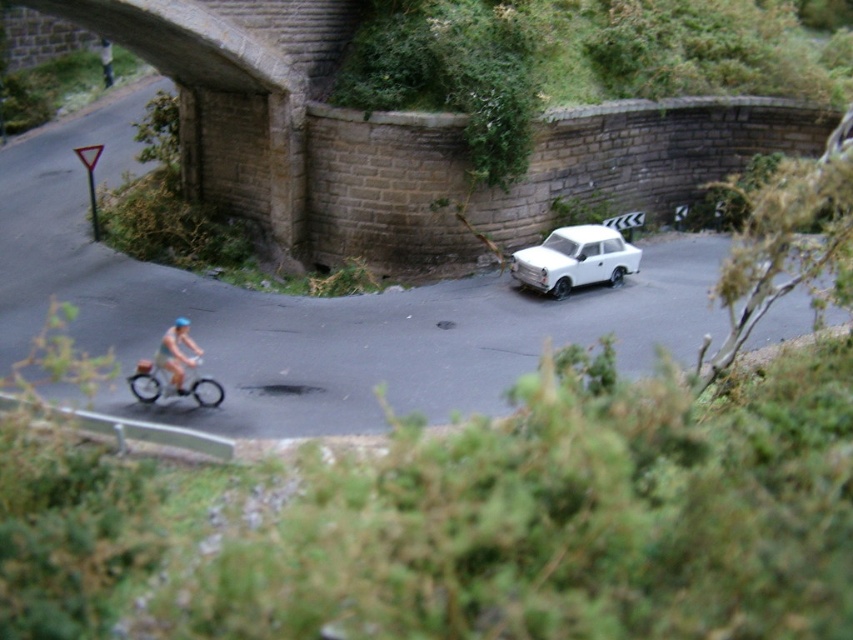
Looking at this image, what object is located at the coordinates point (575,259)?

The white matte car at center is located at point (575,259).

You are a miniature figure trying to move from the road to the parked car in the scene. Can you walk directly from the road to the white matte car at center without stepping on the light blue fabric cyclist at lower left?

The white matte car at center is positioned over the light blue fabric cyclist at lower left, so you cannot walk directly to the white matte car at center without stepping on the cyclist.